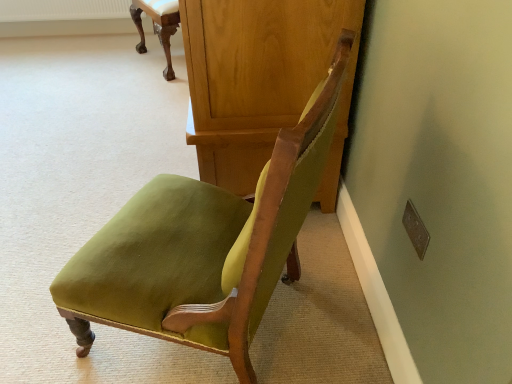
Question: Which direction should I rotate to face velvet green chair at center, positioned as the second chair in back-to-front order, — up or down?

Choices:
 (A) up
 (B) down

Answer: (B)

Question: From the image's perspective, would you say wooden dresser at center is shown under velvet green chair at center, the 1th chair when ordered from bottom to top?

Choices:
 (A) yes
 (B) no

Answer: (B)

Question: Considering the relative sizes of wooden dresser at center and velvet green chair at center, the 1th chair when ordered from bottom to top, in the image provided, is wooden dresser at center smaller than velvet green chair at center, the 1th chair when ordered from bottom to top,?

Choices:
 (A) no
 (B) yes

Answer: (A)

Question: Considering the relative positions of wooden dresser at center and velvet green chair at center, the 1th chair when ordered from bottom to top, in the image provided, is wooden dresser at center to the right of velvet green chair at center, the 1th chair when ordered from bottom to top, from the viewer's perspective?

Choices:
 (A) no
 (B) yes

Answer: (B)

Question: Does wooden dresser at center have a lesser height compared to velvet green chair at center, the first chair from the front?

Choices:
 (A) no
 (B) yes

Answer: (B)

Question: Would you say wooden dresser at center is outside velvet green chair at center, positioned as the second chair in back-to-front order?

Choices:
 (A) yes
 (B) no

Answer: (A)

Question: From a real-world perspective, is wooden dresser at center on top of velvet green chair at center, the 1th chair when ordered from bottom to top?

Choices:
 (A) no
 (B) yes

Answer: (A)

Question: From the image's perspective, would you say matte green fabric chair at upper center, the first chair when ordered from top to bottom, is shown under velvet green chair at center, positioned as the second chair in back-to-front order?

Choices:
 (A) yes
 (B) no

Answer: (B)

Question: Does matte green fabric chair at upper center, acting as the 2th chair starting from the front, have a lesser width compared to velvet green chair at center, positioned as the second chair in back-to-front order?

Choices:
 (A) no
 (B) yes

Answer: (B)

Question: Can you confirm if matte green fabric chair at upper center, acting as the 2th chair starting from the front, is smaller than velvet green chair at center, positioned as the second chair in back-to-front order?

Choices:
 (A) no
 (B) yes

Answer: (B)

Question: Can you confirm if matte green fabric chair at upper center, which ranks as the 1th chair in back-to-front order, is wider than velvet green chair at center, which ranks as the 2th chair in top-to-bottom order?

Choices:
 (A) no
 (B) yes

Answer: (A)

Question: Is velvet green chair at center, which ranks as the 2th chair in top-to-bottom order, at the back of matte green fabric chair at upper center, acting as the 2th chair starting from the front?

Choices:
 (A) no
 (B) yes

Answer: (A)

Question: Is matte green fabric chair at upper center, the first chair when ordered from top to bottom, not near velvet green chair at center, positioned as the second chair in back-to-front order?

Choices:
 (A) yes
 (B) no

Answer: (A)

Question: Is matte green fabric chair at upper center, the first chair when ordered from top to bottom, thinner than wooden dresser at center?

Choices:
 (A) no
 (B) yes

Answer: (B)